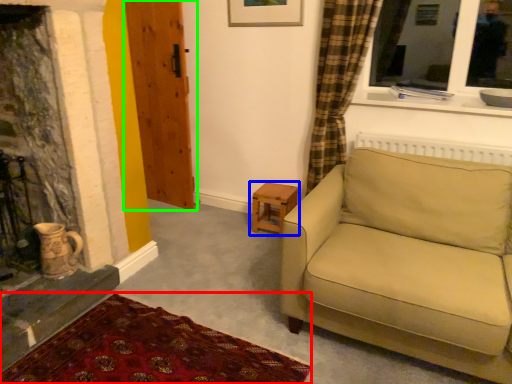
Question: Which object is the closest to the plain (highlighted by a red box)? Choose among these: table (highlighted by a blue box) or door (highlighted by a green box).

Choices:
 (A) table
 (B) door

Answer: (A)